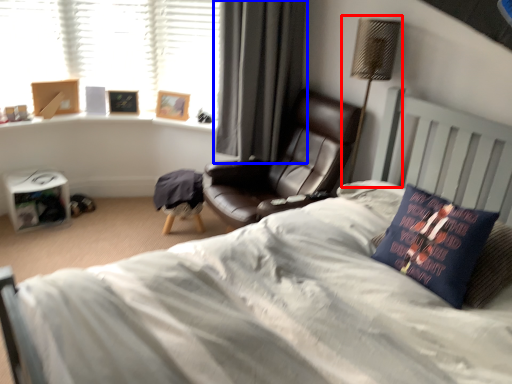
Question: Which object is closer to the camera taking this photo, table lamp (highlighted by a red box) or curtain (highlighted by a blue box)?

Choices:
 (A) table lamp
 (B) curtain

Answer: (A)